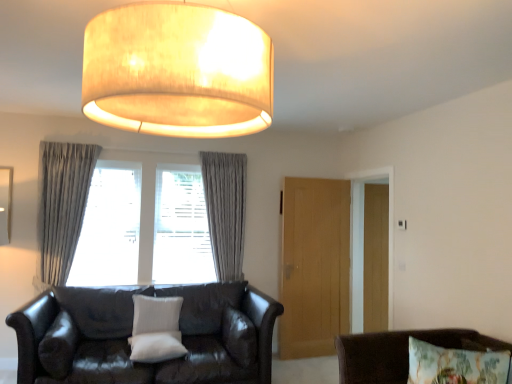
Question: Is the position of transparent wood door at right, marked as the first glass door in a back-to-front arrangement, more distant than that of gray textured curtains at center?

Choices:
 (A) yes
 (B) no

Answer: (A)

Question: Does transparent wood door at right, which is counted as the first glass door, starting from the right, have a larger size compared to gray textured curtains at center?

Choices:
 (A) yes
 (B) no

Answer: (B)

Question: Could you tell me if transparent wood door at right, which is counted as the first glass door, starting from the right, is facing gray textured curtains at center?

Choices:
 (A) no
 (B) yes

Answer: (A)

Question: From a real-world perspective, does transparent wood door at right, acting as the 2th glass door starting from the front, stand above gray textured curtains at center?

Choices:
 (A) yes
 (B) no

Answer: (B)

Question: Considering the relative sizes of transparent wood door at right, which is the 2th glass door in left-to-right order, and gray textured curtains at center in the image provided, is transparent wood door at right, which is the 2th glass door in left-to-right order, shorter than gray textured curtains at center?

Choices:
 (A) yes
 (B) no

Answer: (B)

Question: Is white soft pillow at center, the 2th pillow in the back-to-front sequence, inside the boundaries of light brown wooden door at center, acting as the first glass door starting from the left, or outside?

Choices:
 (A) outside
 (B) inside

Answer: (A)

Question: In the image, is white soft pillow at center, placed as the first pillow when sorted from front to back, positioned in front of or behind light brown wooden door at center, acting as the first glass door starting from the left?

Choices:
 (A) behind
 (B) front

Answer: (B)

Question: Based on their sizes in the image, would you say white soft pillow at center, placed as the first pillow when sorted from front to back, is bigger or smaller than light brown wooden door at center, which is the 2th glass door in right-to-left order?

Choices:
 (A) big
 (B) small

Answer: (B)

Question: Does point (157, 355) appear closer or farther from the camera than point (307, 334)?

Choices:
 (A) farther
 (B) closer

Answer: (B)

Question: Is gray textured curtains at center wider or thinner than matte beige lampshade at upper center?

Choices:
 (A) wide
 (B) thin

Answer: (B)

Question: From the image's perspective, is gray textured curtains at center located above or below matte beige lampshade at upper center?

Choices:
 (A) below
 (B) above

Answer: (A)

Question: Considering the positions of gray textured curtains at center and matte beige lampshade at upper center in the image, is gray textured curtains at center taller or shorter than matte beige lampshade at upper center?

Choices:
 (A) tall
 (B) short

Answer: (A)

Question: In the image, is gray textured curtains at center positioned in front of or behind matte beige lampshade at upper center?

Choices:
 (A) behind
 (B) front

Answer: (A)

Question: From a real-world perspective, is transparent wood door at right, acting as the 2th glass door starting from the front, physically located above or below light brown wooden door at center, which is the 1th glass door in front-to-back order?

Choices:
 (A) above
 (B) below

Answer: (A)

Question: Does point (377, 223) appear closer or farther from the camera than point (286, 216)?

Choices:
 (A) farther
 (B) closer

Answer: (B)